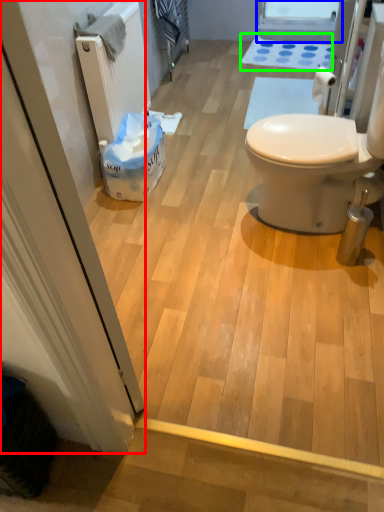
Question: Which is nearer to the screen door (highlighted by a red box)? window screen (highlighted by a blue box) or bath mat (highlighted by a green box).

Choices:
 (A) window screen
 (B) bath mat

Answer: (B)